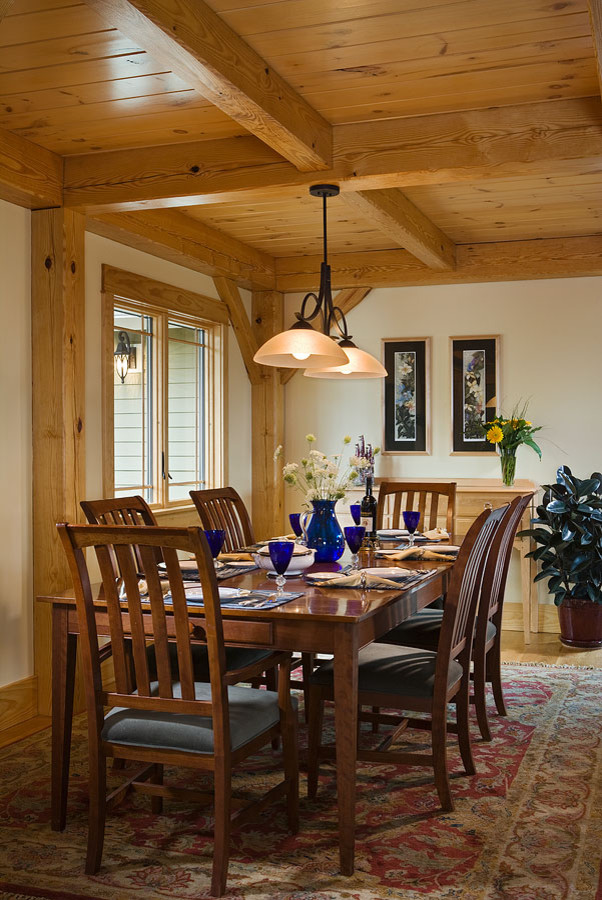
Where is `light`? Image resolution: width=602 pixels, height=900 pixels. light is located at coordinates (300, 351), (354, 357), (126, 362).